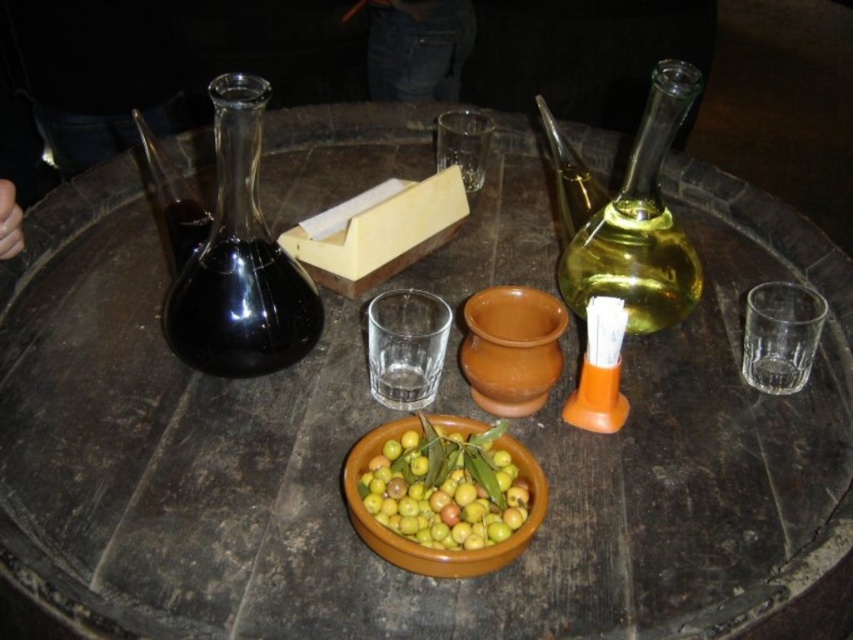
You are setting up a tasting station and need to place a new item between the green matte bowl at center and the translucent glass carafe at upper left. Based on their current positions, which object should the new item be closer to?

The new item should be closer to the translucent glass carafe at upper left because the green matte bowl at center is positioned on the right side of it.

In the scene shown: You are setting up a tasting station and need to place a new item between the transparent glass carafe at left and the terracotta mortar and pestle. Based on their positions, where should you position the new item?

The transparent glass carafe at left is located at point (241, 259). Since the mortar and pestle are to the right of the carafe, you should place the new item between these coordinates to ensure it is positioned between them.

You are a guest at a tasting event and want to pour liquid from the transparent glass carafe at left into the terracotta clay bowl at center. Can you do this without moving either object?

The transparent glass carafe at left is closer to the viewer than the terracotta clay bowl at center, so you can pour the liquid from the transparent glass carafe at left into the terracotta clay bowl at center without moving either object because the carafe is positioned in front.